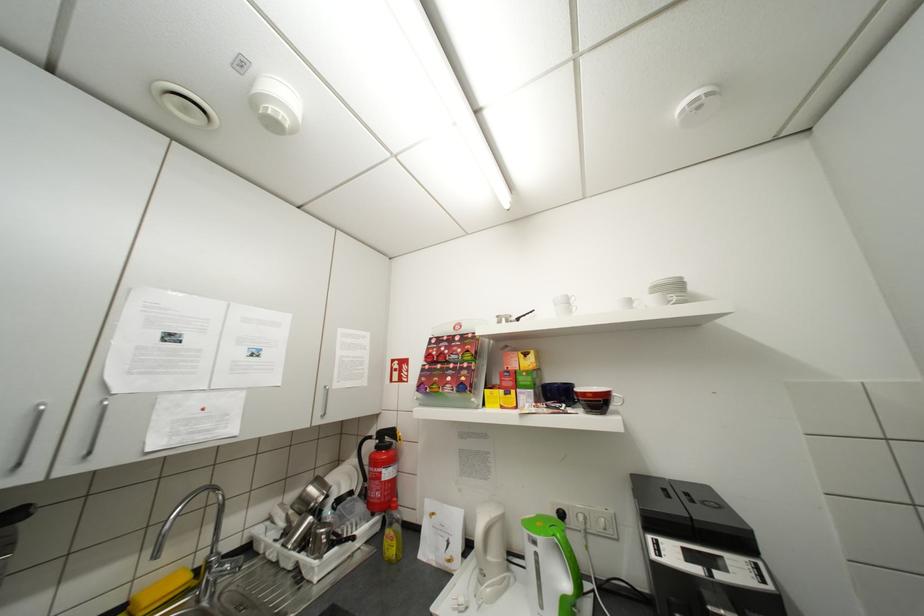
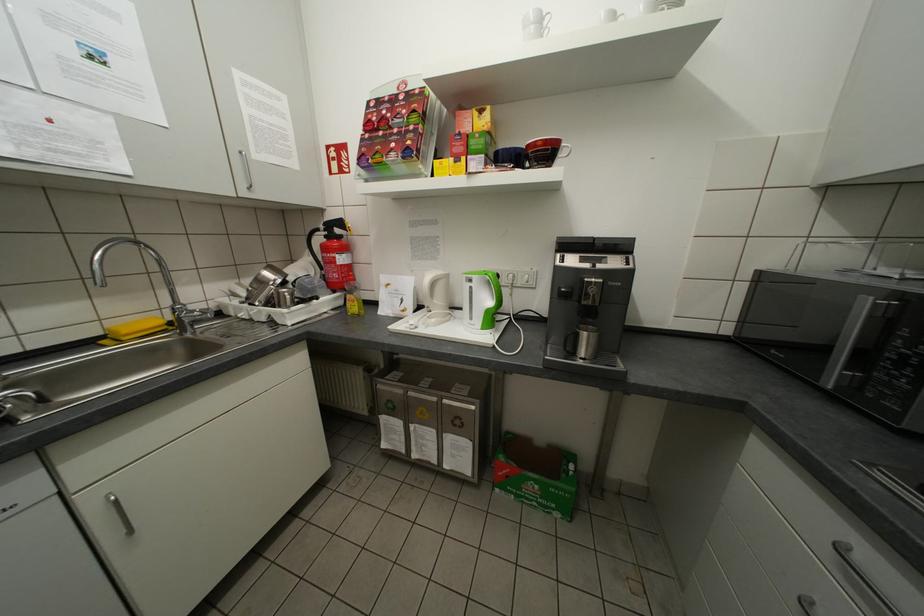
Where in the second image is the point corresponding to the point at 563,536 from the first image?

(494, 274)